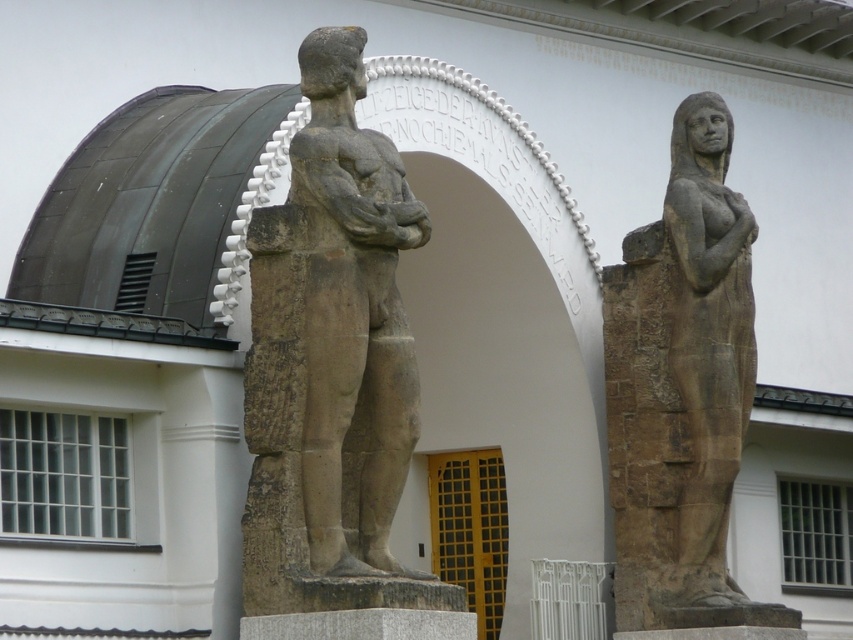
Does brown stone statue at right appear on the right side of matte stone statue at right?

Incorrect, brown stone statue at right is not on the right side of matte stone statue at right.

Can you confirm if brown stone statue at right is smaller than matte stone statue at right?

Incorrect, brown stone statue at right is not smaller in size than matte stone statue at right.

Find the location of a particular element. brown stone statue at right is located at coordinates (682, 388).

Does stone statue at center have a lesser height compared to brown stone statue at right?

Indeed, stone statue at center has a lesser height compared to brown stone statue at right.

Does stone statue at center have a smaller size compared to brown stone statue at right?

Indeed, stone statue at center has a smaller size compared to brown stone statue at right.

You are a GUI agent. You are given a task and a screenshot of the screen. Output one action in this format:
    pyautogui.click(x=<x>, y=<y>)
    Task: Click on the stone statue at center
    
    Given the screenshot: What is the action you would take?
    pyautogui.click(x=331, y=362)

In order to click on stone statue at center in this screenshot , I will do `click(331, 362)`.

Is stone statue at center behind matte stone statue at right?

No, stone statue at center is closer to the viewer.

Is point (300, 550) positioned before point (677, 378)?

Yes, it is in front of point (677, 378).

The height and width of the screenshot is (640, 853). Identify the location of stone statue at center. (331, 362).